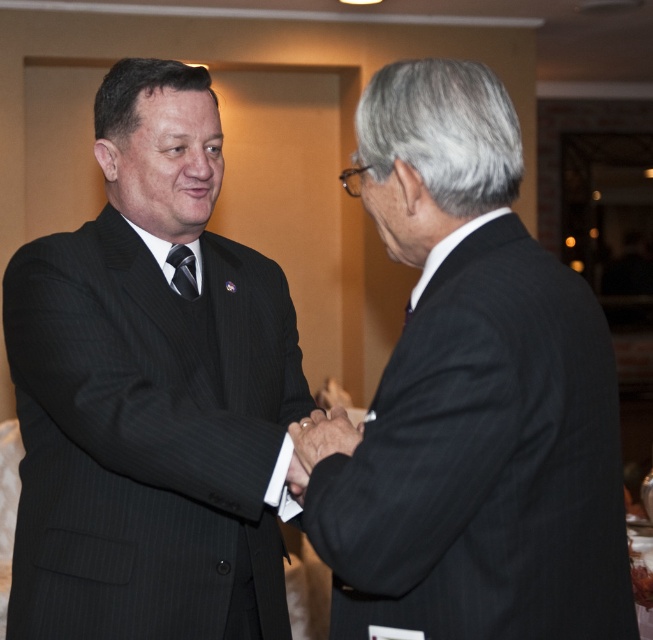
Does black pinstripe suit at right have a lesser width compared to black silk tie at center?

In fact, black pinstripe suit at right might be wider than black silk tie at center.

Which is above, black pinstripe suit at right or black silk tie at center?

Positioned higher is black silk tie at center.

Which is behind, point (449, 442) or point (185, 282)?

The point (185, 282) is more distant.

This screenshot has height=640, width=653. What are the coordinates of `black pinstripe suit at right` in the screenshot? It's located at [x=473, y=396].

Is black pinstripe suit at center smaller than smooth leather hand at center?

Actually, black pinstripe suit at center might be larger than smooth leather hand at center.

What do you see at coordinates (151, 392) in the screenshot? I see `black pinstripe suit at center` at bounding box center [151, 392].

Is point (202, 372) in front of point (298, 444)?

That is False.

You are a GUI agent. You are given a task and a screenshot of the screen. Output one action in this format:
    pyautogui.click(x=<x>, y=<y>)
    Task: Click on the black pinstripe suit at center
    The width and height of the screenshot is (653, 640).
    Given the screenshot: What is the action you would take?
    pyautogui.click(x=151, y=392)

Who is more distant from viewer, (x=214, y=97) or (x=500, y=289)?

Positioned behind is point (x=214, y=97).

How much distance is there between black pinstripe suit at center and black pinstripe suit at right?

black pinstripe suit at center and black pinstripe suit at right are 21.77 inches apart.

The height and width of the screenshot is (640, 653). What do you see at coordinates (151, 392) in the screenshot? I see `black pinstripe suit at center` at bounding box center [151, 392].

Where is `black pinstripe suit at center`? black pinstripe suit at center is located at coordinates (151, 392).